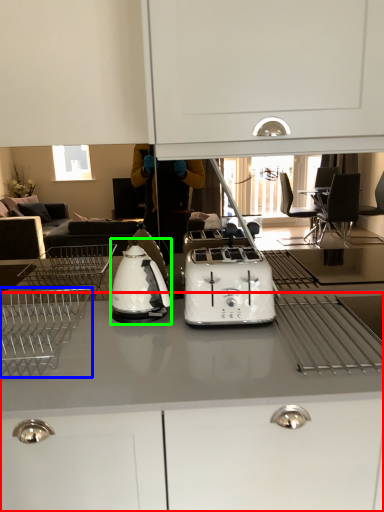
Question: Based on their relative distances, which object is farther from cabinetry (highlighted by a red box)? Choose from home appliance (highlighted by a blue box) and kitchen appliance (highlighted by a green box).

Choices:
 (A) home appliance
 (B) kitchen appliance

Answer: (B)